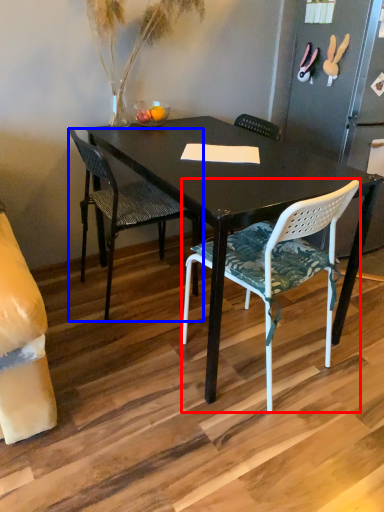
Question: Among these objects, which one is farthest to the camera, chair (highlighted by a red box) or chair (highlighted by a blue box)?

Choices:
 (A) chair
 (B) chair

Answer: (B)